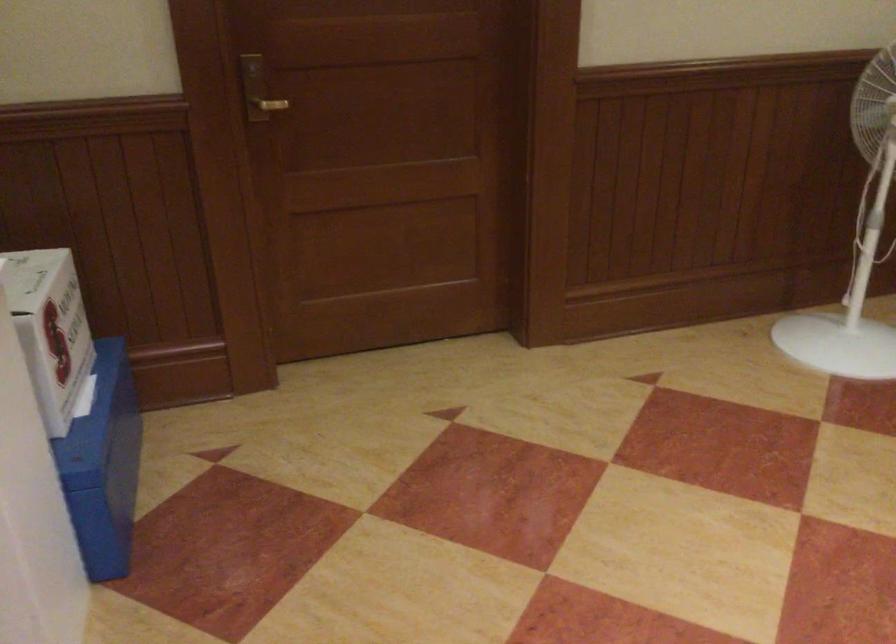
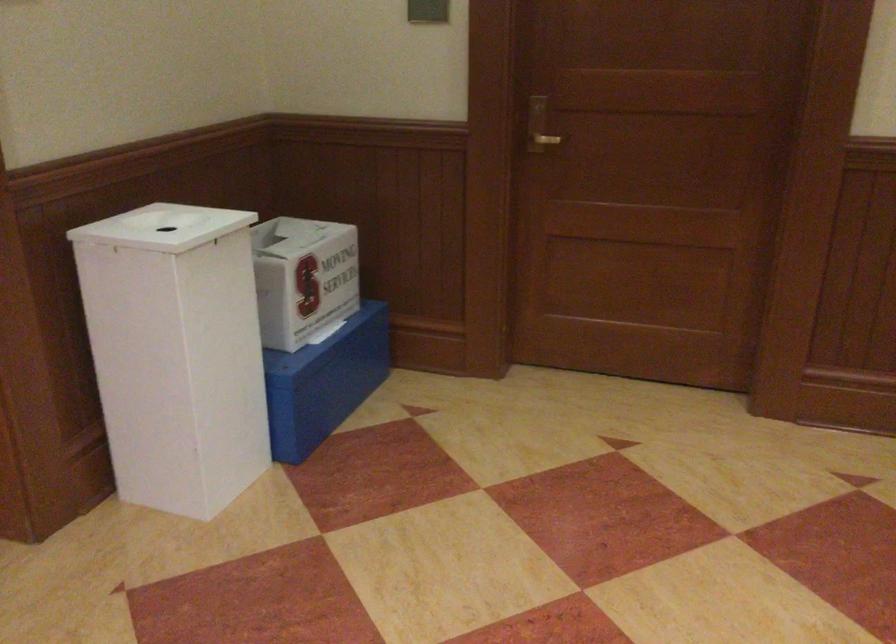
The point at (261,93) is marked in the first image. Where is the corresponding point in the second image?

(538, 126)